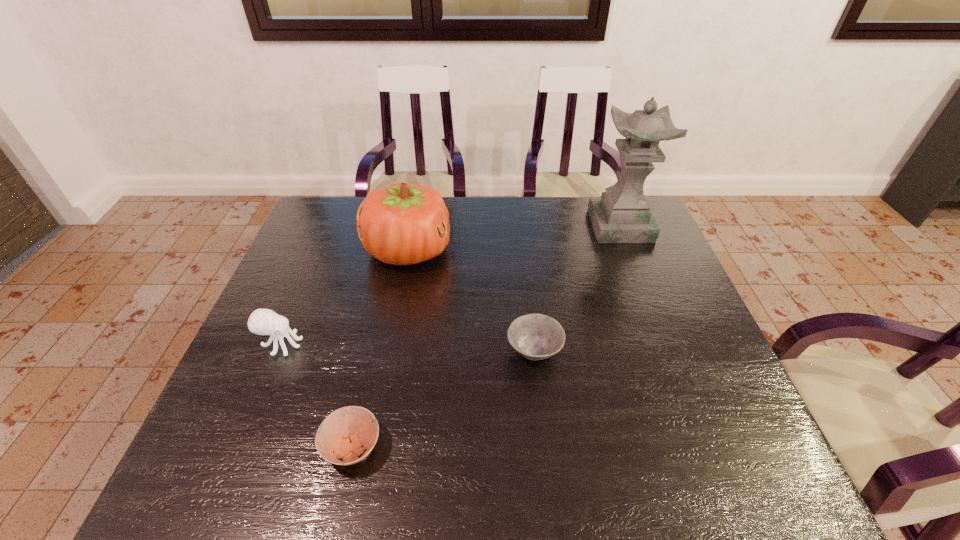
What are the coordinates of `vacant space located on the side of the pumpkin with the cute face` in the screenshot? It's located at (540, 250).

This screenshot has height=540, width=960. Find the location of `free space located 0.050m on the front-facing side of the octopus`. free space located 0.050m on the front-facing side of the octopus is located at coordinates click(x=323, y=344).

Find the location of a particular element. The width and height of the screenshot is (960, 540). free space located 0.160m on the right of the taller bowl is located at coordinates (629, 352).

Image resolution: width=960 pixels, height=540 pixels. Find the location of `blank area located on the left of the left bowl`. blank area located on the left of the left bowl is located at coordinates (212, 447).

The image size is (960, 540). Find the location of `sculpture located at the far edge`. sculpture located at the far edge is located at coordinates (622, 214).

At what (x,y) coordinates should I click in order to perform the action: click on pumpkin situated at the far edge. Please return your answer as a coordinate pair (x, y). Looking at the image, I should click on tap(402, 223).

Where is `object present at the near edge`? object present at the near edge is located at coordinates (344, 432).

The width and height of the screenshot is (960, 540). Find the location of `object that is at the left edge`. object that is at the left edge is located at coordinates (262, 321).

This screenshot has width=960, height=540. In order to click on object located in the right edge section of the desktop in this screenshot , I will do `click(622, 214)`.

Find the location of `object situated at the far right corner`. object situated at the far right corner is located at coordinates (622, 214).